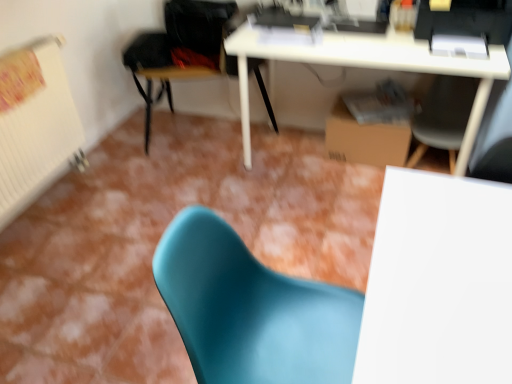
You are a GUI agent. You are given a task and a screenshot of the screen. Output one action in this format:
    pyautogui.click(x=<x>, y=<y>)
    Task: Click on the vacant space in front of white glossy desk at upper center
    
    Given the screenshot: What is the action you would take?
    tap(322, 225)